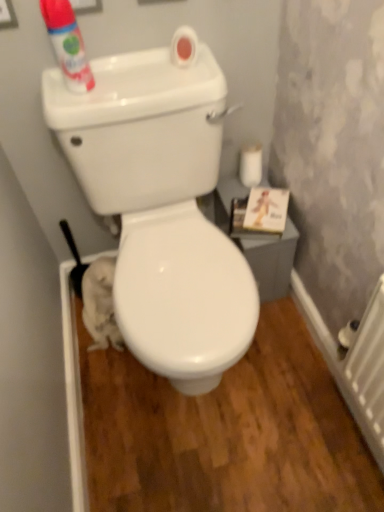
Question: Looking at the image, does white matte toilet paper at right seem bigger or smaller compared to matte white can at upper left?

Choices:
 (A) big
 (B) small

Answer: (B)

Question: In terms of height, does white matte toilet paper at right look taller or shorter compared to matte white can at upper left?

Choices:
 (A) short
 (B) tall

Answer: (A)

Question: Considering the real-world distances, which object is closest to the white plastic radiator at lower right?

Choices:
 (A) white matte toilet paper at right
 (B) matte white can at upper left
 (C) white glossy toilet at center

Answer: (C)

Question: Which of these objects is positioned farthest from the matte white can at upper left?

Choices:
 (A) white glossy toilet at center
 (B) white matte toilet paper at right
 (C) white plastic radiator at lower right

Answer: (C)